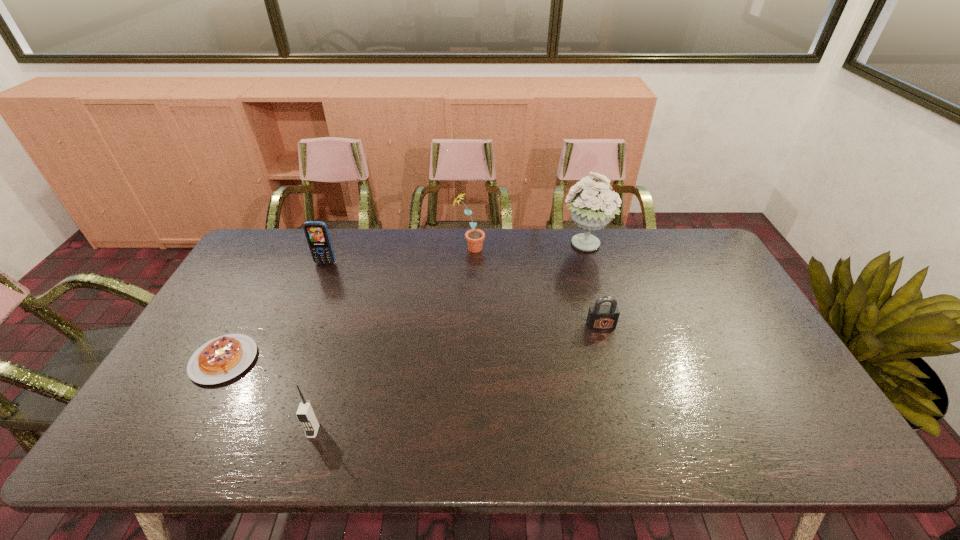
This screenshot has width=960, height=540. In order to click on bouquet in this screenshot , I will do `click(591, 209)`.

Find the location of `the third object from right to left`. the third object from right to left is located at coordinates (474, 237).

Find the location of a particular element. The width and height of the screenshot is (960, 540). sunflower is located at coordinates (474, 237).

Find the location of a particular element. the second object from left to right is located at coordinates (317, 235).

The image size is (960, 540). I want to click on the left cellular telephone, so click(x=317, y=235).

At what (x,y) coordinates should I click in order to perform the action: click on the nearer cellular telephone. Please return your answer as a coordinate pair (x, y). Looking at the image, I should click on pyautogui.click(x=306, y=414).

Identify the location of the right cellular telephone. The width and height of the screenshot is (960, 540). (306, 414).

Locate an element on the screen. padlock is located at coordinates (600, 317).

The height and width of the screenshot is (540, 960). I want to click on the fifth tallest object, so click(600, 317).

Find the location of a particular element. This screenshot has width=960, height=540. the fifth farthest object is located at coordinates (223, 358).